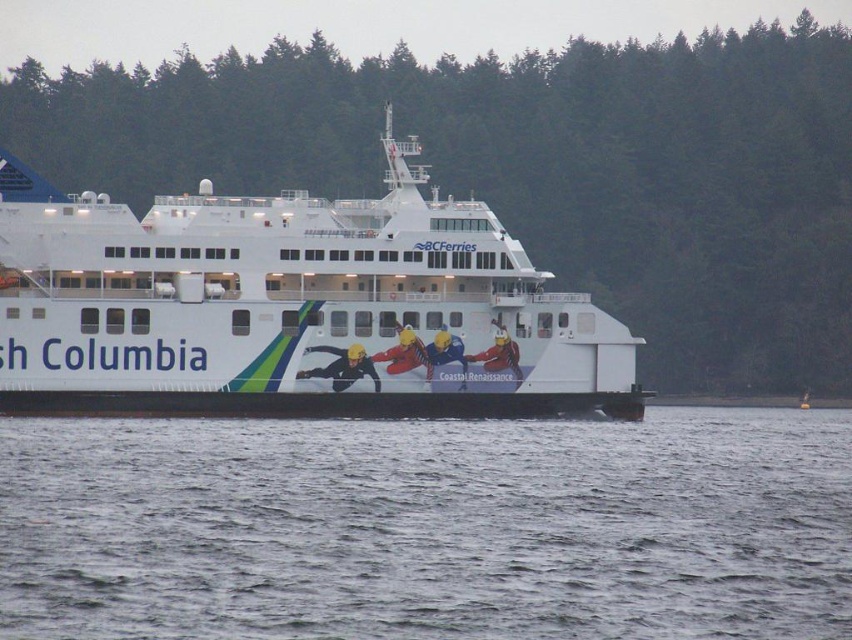
Question: Observing the image, what is the correct spatial positioning of gray water at lower center in reference to white matte ferry at center?

Choices:
 (A) above
 (B) below

Answer: (B)

Question: Which of the following is the closest to the observer?

Choices:
 (A) white matte ferry at center
 (B) gray water at lower center

Answer: (B)

Question: Is gray water at lower center bigger than white matte ferry at center?

Choices:
 (A) yes
 (B) no

Answer: (B)

Question: Can you confirm if gray water at lower center is positioned to the left of white matte ferry at center?

Choices:
 (A) yes
 (B) no

Answer: (B)